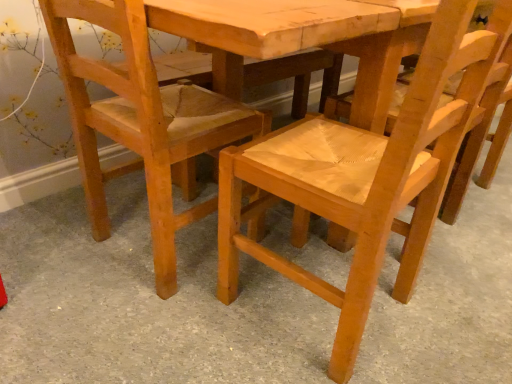
Image resolution: width=512 pixels, height=384 pixels. Identify the location of vacant region to the right of natural wood chair at center, which appears as the 2th chair when viewed from the left. (455, 297).